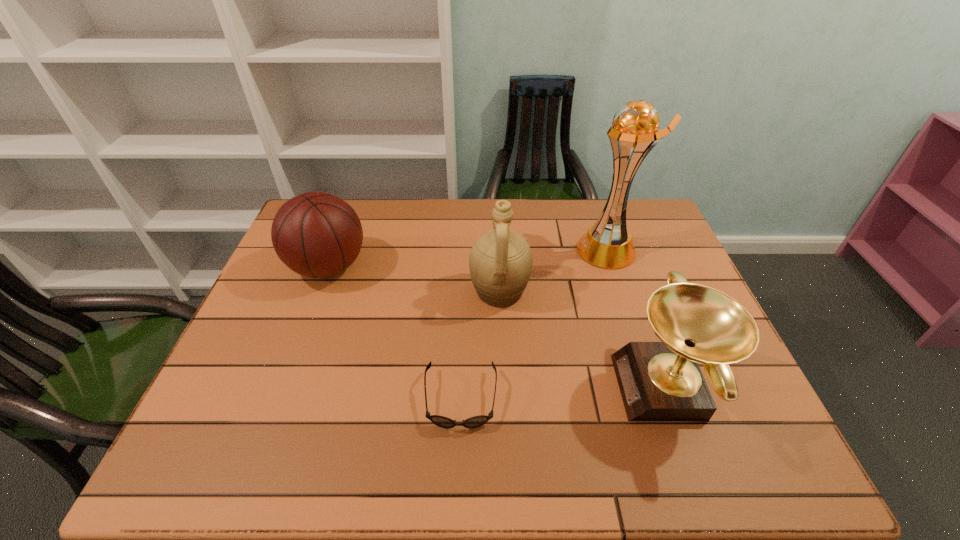
Find the location of a particular element. The image size is (960, 540). the tallest object is located at coordinates tap(608, 243).

The height and width of the screenshot is (540, 960). In order to click on pitcher in this screenshot , I will do `click(500, 262)`.

What are the coordinates of `basketball` in the screenshot? It's located at (316, 234).

Locate an element on the screen. award is located at coordinates (659, 381).

I want to click on the shortest object, so click(x=473, y=422).

This screenshot has width=960, height=540. What are the coordinates of `vacant space located on the front-facing side of the trophy` in the screenshot? It's located at (558, 249).

Identify the location of blank area located on the front-facing side of the trophy. 548,249.

Find the location of a particular element. The height and width of the screenshot is (540, 960). vacant space located on the front-facing side of the trophy is located at coordinates tap(523, 249).

Identify the location of free space located on the front of the fourth shortest object. (502, 345).

Find the location of a particular element. This screenshot has height=540, width=960. free space located on the back of the leftmost object is located at coordinates (349, 212).